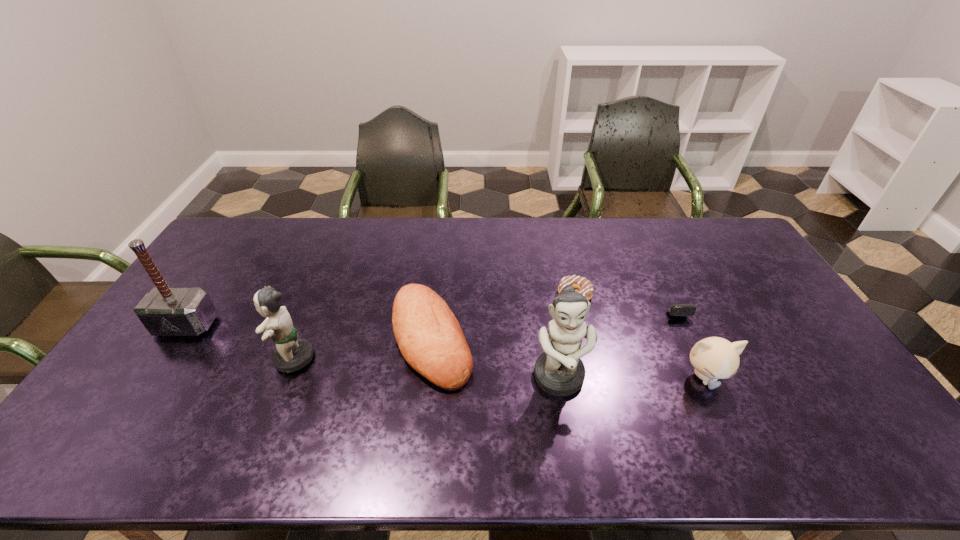
What are the coordinates of `kitten located in the near edge section of the desktop` in the screenshot? It's located at (713, 358).

Image resolution: width=960 pixels, height=540 pixels. What are the coordinates of `object located at the left edge` in the screenshot? It's located at (164, 311).

I want to click on vacant space at the far edge, so click(x=564, y=251).

Where is `vacant area at the near edge`? vacant area at the near edge is located at coordinates (801, 409).

Find the location of a particular element. free space at the left edge is located at coordinates (223, 285).

The height and width of the screenshot is (540, 960). I want to click on vacant area at the right edge, so point(713,261).

You are a GUI agent. You are given a task and a screenshot of the screen. Output one action in this format:
    pyautogui.click(x=<x>, y=<y>)
    Task: Click on the vacant region at the far right corner of the desktop
    The height and width of the screenshot is (540, 960).
    Given the screenshot: What is the action you would take?
    pyautogui.click(x=751, y=253)

You are a GUI agent. You are given a task and a screenshot of the screen. Output one action in this format:
    pyautogui.click(x=<x>, y=<y>)
    Task: Click on the vacant space that's between the taller figurine and the webcam
    The height and width of the screenshot is (540, 960).
    Given the screenshot: What is the action you would take?
    pyautogui.click(x=612, y=337)

You are a GUI agent. You are given a task and a screenshot of the screen. Output one action in this format:
    pyautogui.click(x=<x>, y=<y>)
    Task: Click on the vacant space that is in between the leftmost object and the right figurine
    The height and width of the screenshot is (540, 960).
    Given the screenshot: What is the action you would take?
    pyautogui.click(x=372, y=353)

Locate an element on the screen. The width and height of the screenshot is (960, 540). free space between the taller figurine and the webcam is located at coordinates (612, 337).